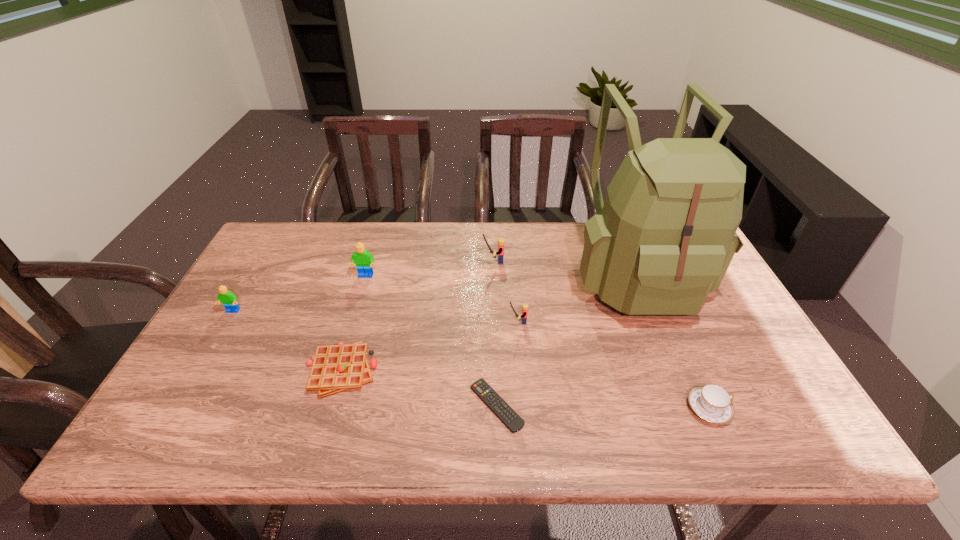
I want to click on teacup, so click(711, 402).

In order to click on blue teacup in this screenshot , I will do `click(711, 402)`.

You are a GUI agent. You are given a task and a screenshot of the screen. Output one action in this format:
    pyautogui.click(x=<x>, y=<y>)
    Task: Click on the seventh tallest object
    Image resolution: width=960 pixels, height=540 pixels.
    Given the screenshot: What is the action you would take?
    pyautogui.click(x=335, y=368)

Where is `remote control`? remote control is located at coordinates click(481, 388).

At what (x,y) coordinates should I click in order to perform the action: click on free space located 0.200m on the front pocket of the green backpack. Please return your answer as a coordinate pair (x, y). This screenshot has width=960, height=540. Looking at the image, I should click on (684, 397).

This screenshot has height=540, width=960. Find the location of `vacant space located 0.130m on the front-facing side of the farther yellow Lego`. vacant space located 0.130m on the front-facing side of the farther yellow Lego is located at coordinates (441, 261).

This screenshot has height=540, width=960. What are the coordinates of `free location located on the front-facing side of the farther yellow Lego` in the screenshot? It's located at (447, 261).

I want to click on vacant space located 0.160m on the front-facing side of the farther yellow Lego, so click(431, 261).

This screenshot has width=960, height=540. I want to click on vacant space situated 0.300m on the face of the farther green Lego, so click(x=341, y=360).

This screenshot has width=960, height=540. I want to click on free space located 0.080m on the front-facing side of the smaller yellow Lego, so click(478, 322).